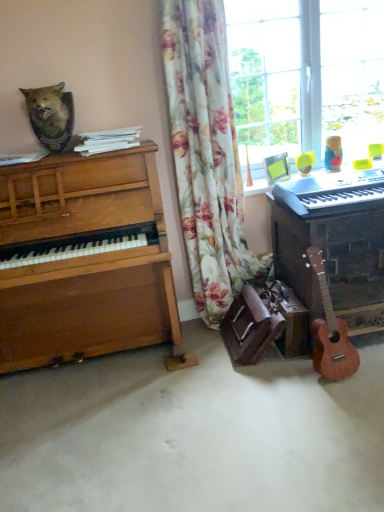
Question: From the image's perspective, would you say white plastic keyboard at right is positioned over wooden piano at right, the second piano from the left?

Choices:
 (A) yes
 (B) no

Answer: (A)

Question: From the image's perspective, does white plastic keyboard at right appear lower than wooden piano at right, the second piano from the left?

Choices:
 (A) yes
 (B) no

Answer: (B)

Question: Does white plastic keyboard at right have a greater width compared to wooden piano at right, the 1th piano viewed from the right?

Choices:
 (A) yes
 (B) no

Answer: (B)

Question: From a real-world perspective, is white plastic keyboard at right beneath wooden piano at right, the second piano from the left?

Choices:
 (A) no
 (B) yes

Answer: (A)

Question: Could you tell me if white plastic keyboard at right is facing wooden piano at right, the second piano from the left?

Choices:
 (A) no
 (B) yes

Answer: (A)

Question: Does white plastic keyboard at right appear on the right side of wooden piano at right, the second piano from the left?

Choices:
 (A) yes
 (B) no

Answer: (B)

Question: Is rustic wooden plaque at upper left placed right next to light brown wood guitar at lower right?

Choices:
 (A) no
 (B) yes

Answer: (A)

Question: Can you confirm if rustic wooden plaque at upper left is positioned to the right of light brown wood guitar at lower right?

Choices:
 (A) no
 (B) yes

Answer: (A)

Question: Is rustic wooden plaque at upper left thinner than light brown wood guitar at lower right?

Choices:
 (A) no
 (B) yes

Answer: (A)

Question: Is the depth of rustic wooden plaque at upper left greater than that of light brown wood guitar at lower right?

Choices:
 (A) no
 (B) yes

Answer: (B)

Question: Considering the relative positions of rustic wooden plaque at upper left and light brown wood guitar at lower right in the image provided, is rustic wooden plaque at upper left to the left of light brown wood guitar at lower right from the viewer's perspective?

Choices:
 (A) no
 (B) yes

Answer: (B)

Question: Considering the relative sizes of rustic wooden plaque at upper left and light brown wood guitar at lower right in the image provided, is rustic wooden plaque at upper left taller than light brown wood guitar at lower right?

Choices:
 (A) yes
 (B) no

Answer: (B)

Question: From a real-world perspective, does floral fabric curtain at center sit lower than white plastic keyboard at right?

Choices:
 (A) no
 (B) yes

Answer: (A)